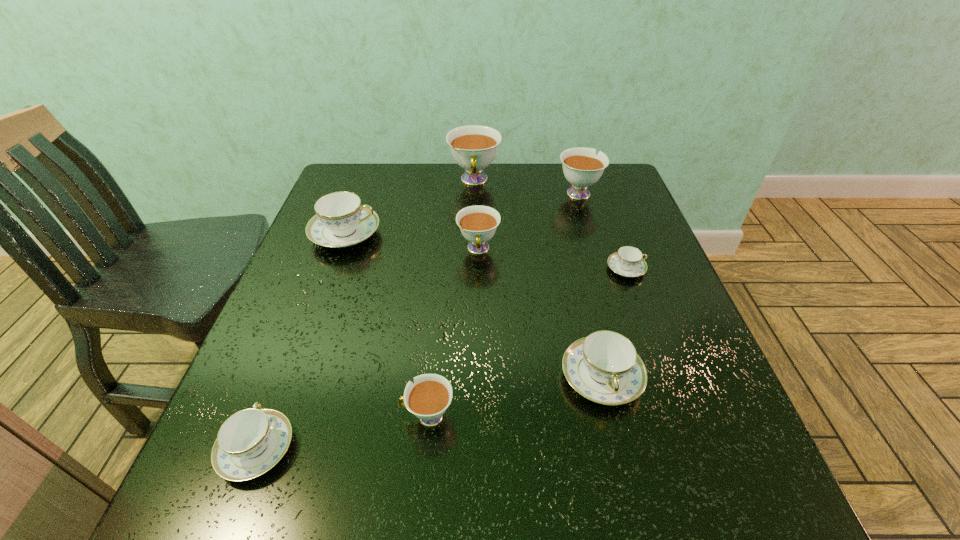
Locate an element on the screen. This screenshot has height=540, width=960. the biggest white teacup is located at coordinates (473, 147).

The height and width of the screenshot is (540, 960). I want to click on the tallest teacup, so click(x=473, y=147).

Where is `the third smallest white teacup`? The image size is (960, 540). the third smallest white teacup is located at coordinates (582, 168).

What are the coordinates of `the second tallest teacup` in the screenshot? It's located at (582, 168).

The width and height of the screenshot is (960, 540). Identify the location of the biggest blue teacup. (340, 221).

The height and width of the screenshot is (540, 960). Identify the location of the third biggest white teacup. (478, 224).

Where is `the second biggest blue teacup`? the second biggest blue teacup is located at coordinates tap(604, 367).

Identify the location of the nearest white teacup. The width and height of the screenshot is (960, 540). (428, 398).

Image resolution: width=960 pixels, height=540 pixels. I want to click on the second smallest blue teacup, so click(252, 441).

The height and width of the screenshot is (540, 960). What are the coordinates of `the smallest blue teacup` in the screenshot? It's located at (628, 261).